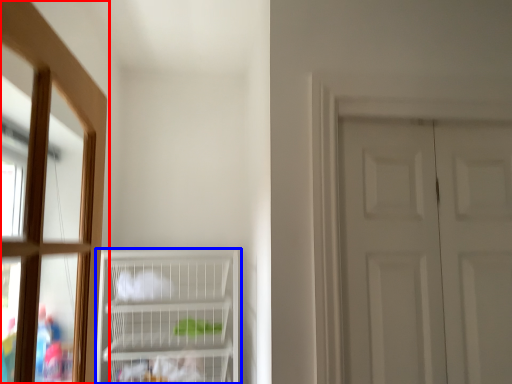
Question: Among these objects, which one is nearest to the camera, window (highlighted by a red box) or cupboard (highlighted by a blue box)?

Choices:
 (A) window
 (B) cupboard

Answer: (A)